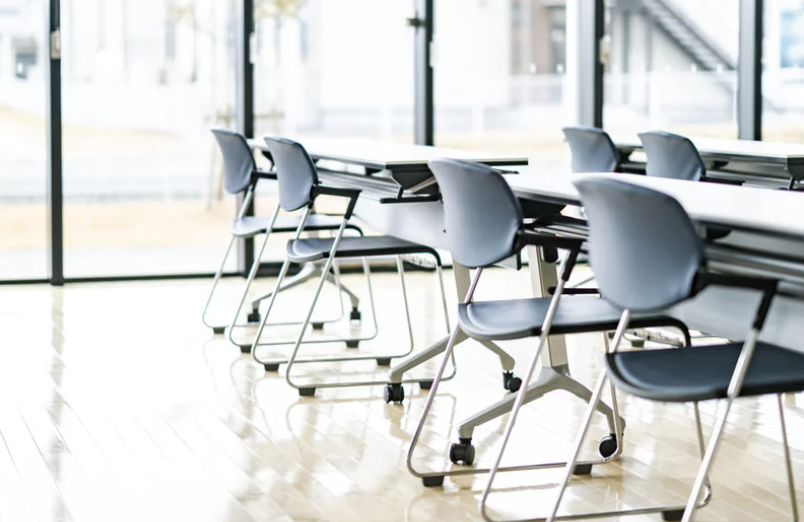
Find the location of a particular element. This screenshot has width=804, height=522. windows is located at coordinates (23, 176), (119, 177), (325, 96), (506, 99), (678, 108), (772, 108).